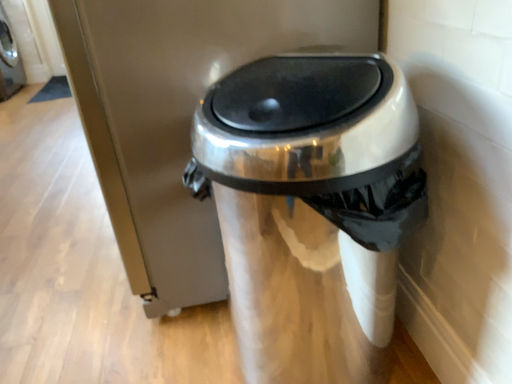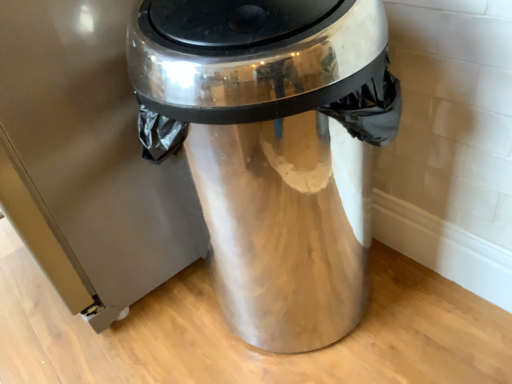
Question: Which way did the camera rotate in the video?

Choices:
 (A) rotated right
 (B) rotated left

Answer: (A)